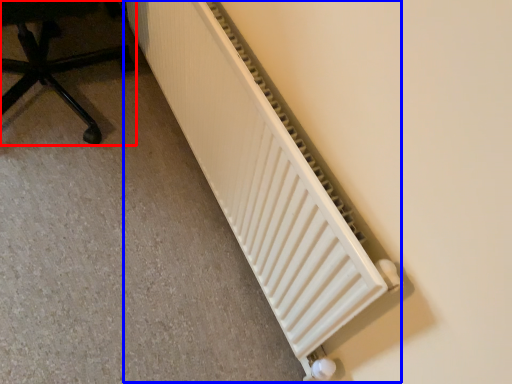
Question: Which point is further to the camera, furniture (highlighted by a red box) or radiator (highlighted by a blue box)?

Choices:
 (A) furniture
 (B) radiator

Answer: (A)